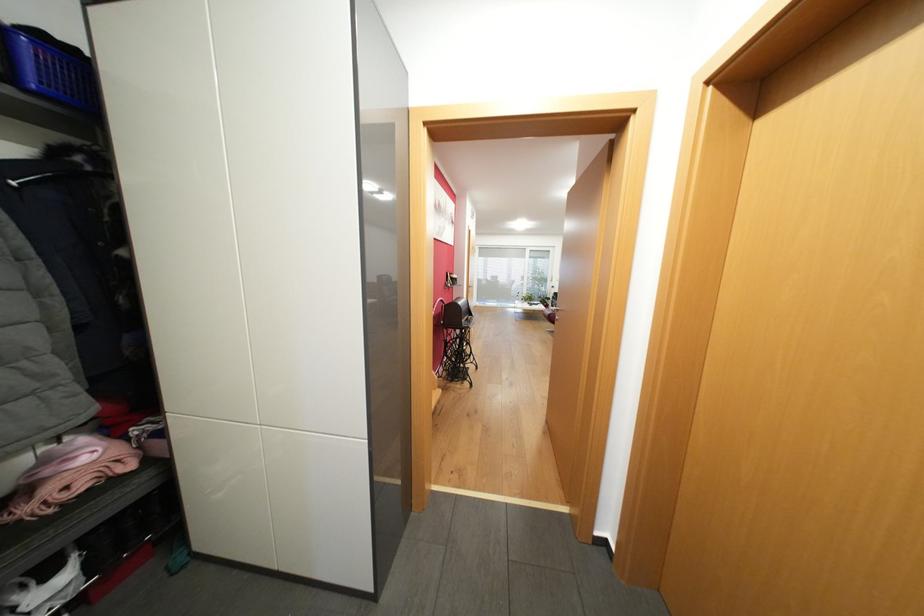
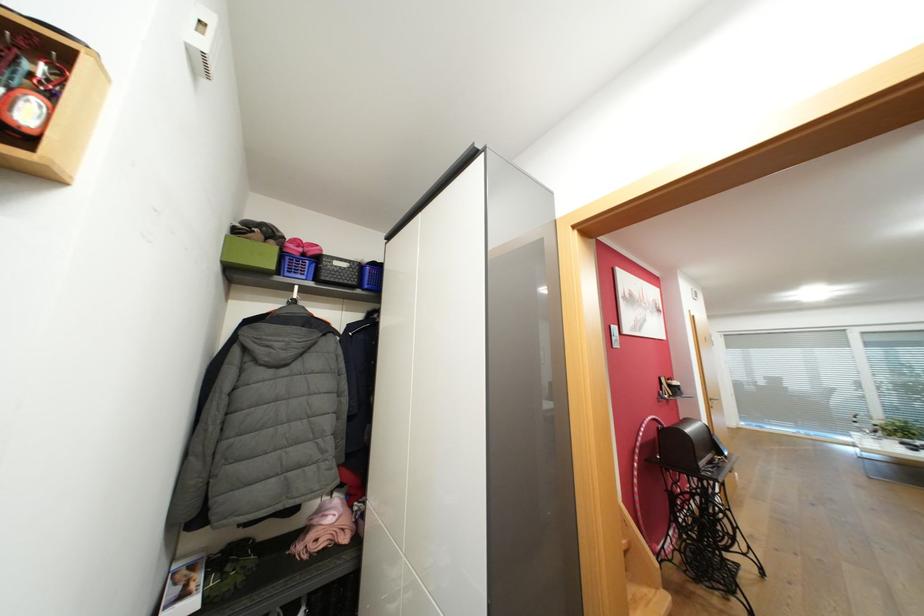
The first image is from the beginning of the video and the second image is from the end. How did the camera likely rotate when shooting the video?

The rotation direction of the camera is left-up.